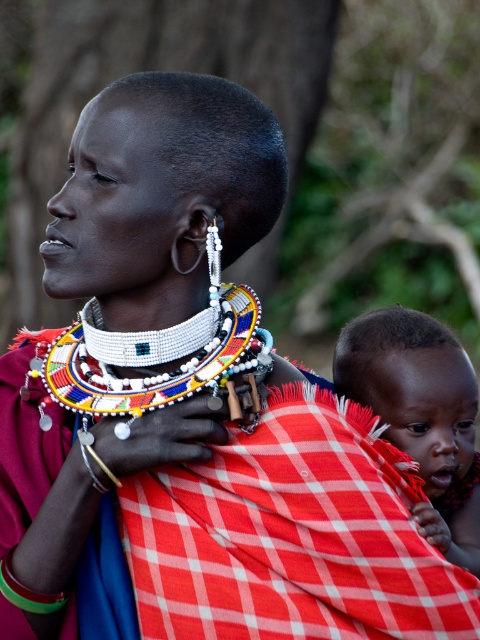
You are a photographer trying to capture the cultural details of the scene. You notice the matte red cloth at center and the white beaded necklace at center. Which one is positioned lower in the image?

The matte red cloth at center is located below the white beaded necklace at center, so it is positioned lower in the image.